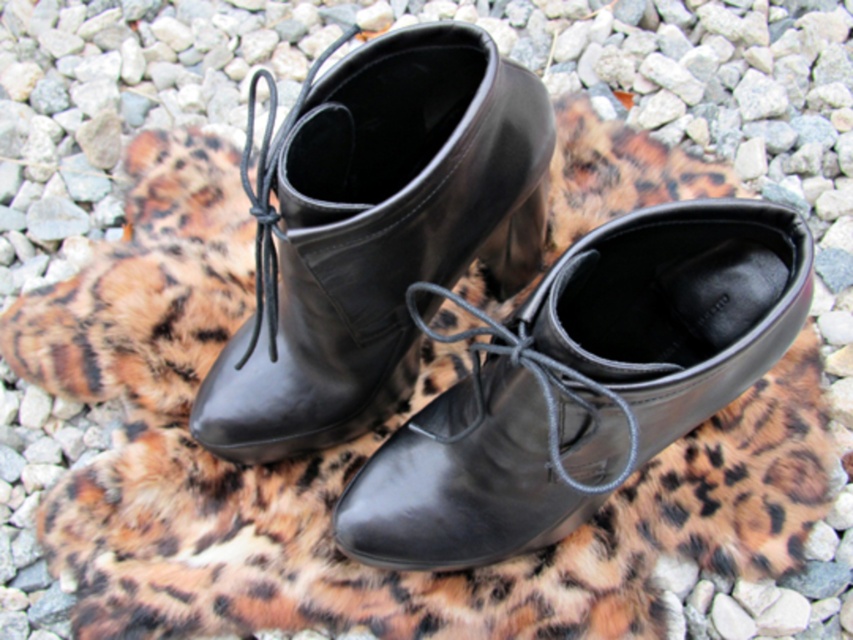
Question: Can you confirm if black leather shoe at center is positioned to the right of shiny black boot at center?

Choices:
 (A) yes
 (B) no

Answer: (A)

Question: Is the position of black leather shoe at center less distant than that of shiny black boot at center?

Choices:
 (A) yes
 (B) no

Answer: (A)

Question: Is black leather shoe at center positioned at the back of shiny black boot at center?

Choices:
 (A) yes
 (B) no

Answer: (B)